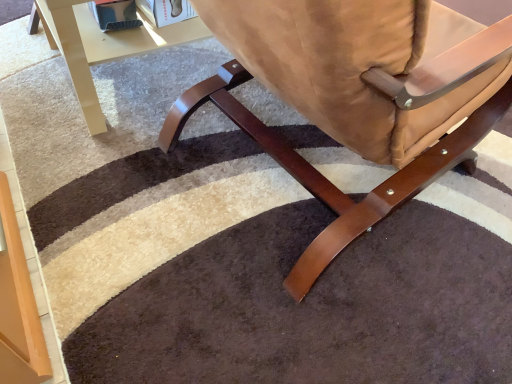
Question: Is glossy beige table at upper left at the right side of satin brown leather chair at center?

Choices:
 (A) yes
 (B) no

Answer: (B)

Question: Is the depth of glossy beige table at upper left less than that of satin brown leather chair at center?

Choices:
 (A) no
 (B) yes

Answer: (A)

Question: Is glossy beige table at upper left to the left of satin brown leather chair at center from the viewer's perspective?

Choices:
 (A) no
 (B) yes

Answer: (B)

Question: Considering the relative sizes of glossy beige table at upper left and satin brown leather chair at center in the image provided, is glossy beige table at upper left smaller than satin brown leather chair at center?

Choices:
 (A) no
 (B) yes

Answer: (B)

Question: Does glossy beige table at upper left have a lesser height compared to satin brown leather chair at center?

Choices:
 (A) no
 (B) yes

Answer: (B)

Question: Can satin brown leather chair at center be found inside glossy beige table at upper left?

Choices:
 (A) no
 (B) yes

Answer: (A)

Question: From the image's perspective, is satin brown leather chair at center beneath glossy beige table at upper left?

Choices:
 (A) yes
 (B) no

Answer: (A)

Question: Could you tell me if satin brown leather chair at center is turned towards glossy beige table at upper left?

Choices:
 (A) yes
 (B) no

Answer: (B)

Question: Is satin brown leather chair at center taller than glossy beige table at upper left?

Choices:
 (A) no
 (B) yes

Answer: (B)

Question: Does satin brown leather chair at center have a greater width compared to glossy beige table at upper left?

Choices:
 (A) no
 (B) yes

Answer: (B)

Question: From a real-world perspective, is satin brown leather chair at center under glossy beige table at upper left?

Choices:
 (A) no
 (B) yes

Answer: (A)

Question: Would you say satin brown leather chair at center is outside glossy beige table at upper left?

Choices:
 (A) yes
 (B) no

Answer: (A)

Question: Is point (248, 114) positioned closer to the camera than point (181, 41)?

Choices:
 (A) closer
 (B) farther

Answer: (A)